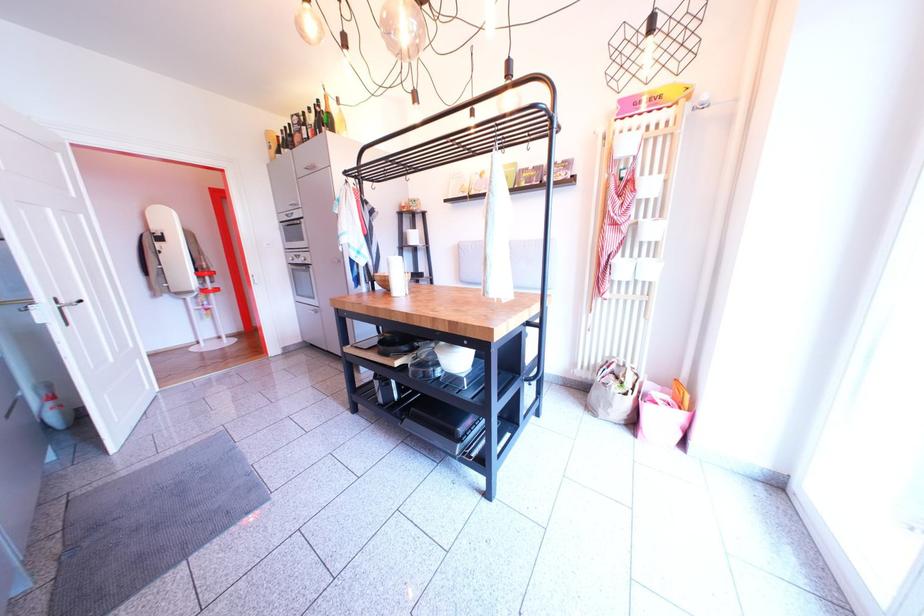
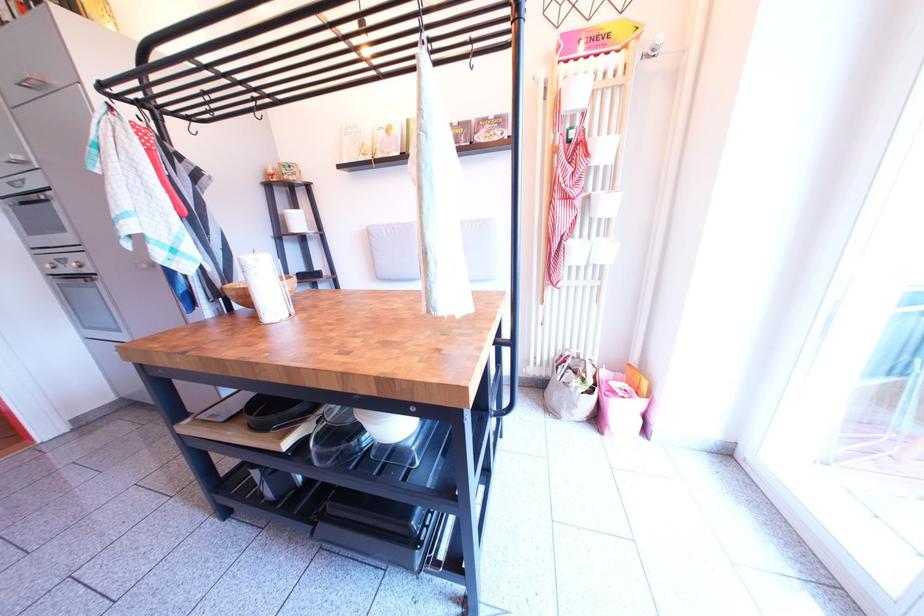
In the second image, find the point that corresponds to (643,429) in the first image.

(608, 426)